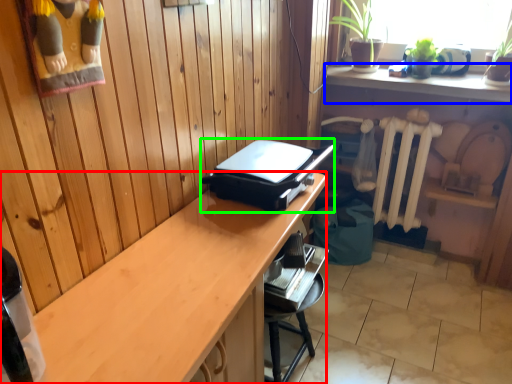
Question: Which object is positioned closest to desk (highlighted by a red box)? Select from shelf (highlighted by a blue box) and appliance (highlighted by a green box).

Choices:
 (A) shelf
 (B) appliance

Answer: (B)